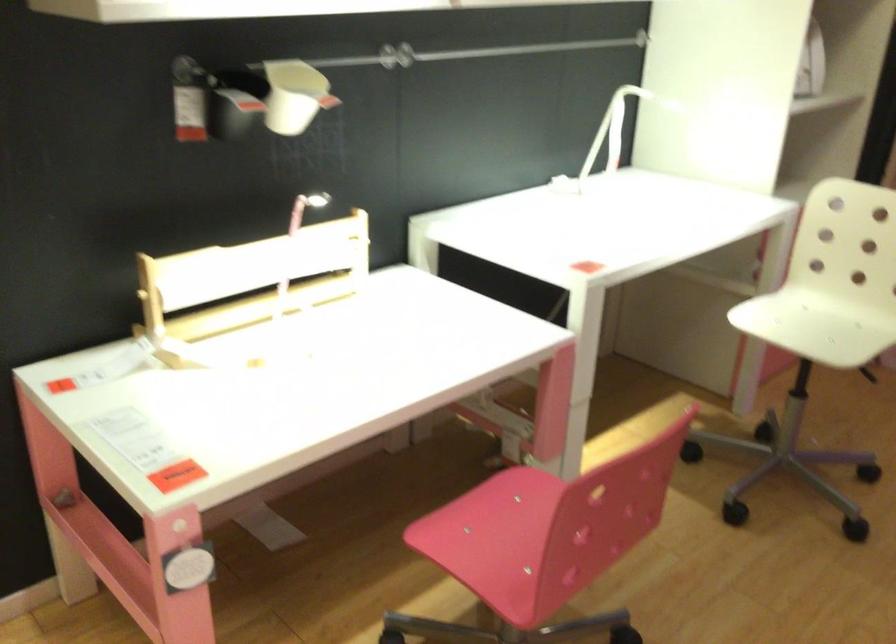
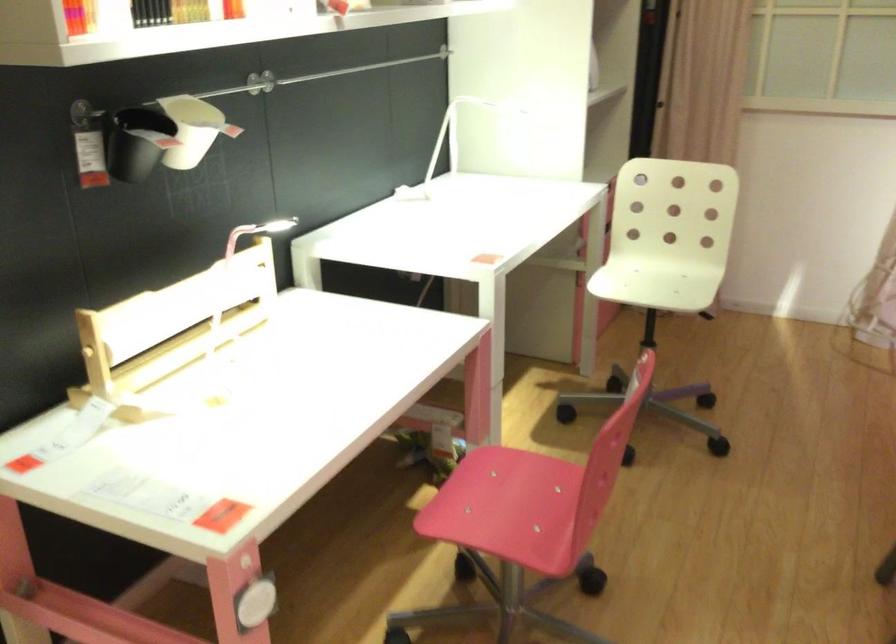
Find the pixel in the second image that matches the point at 282,95 in the first image.

(193, 129)